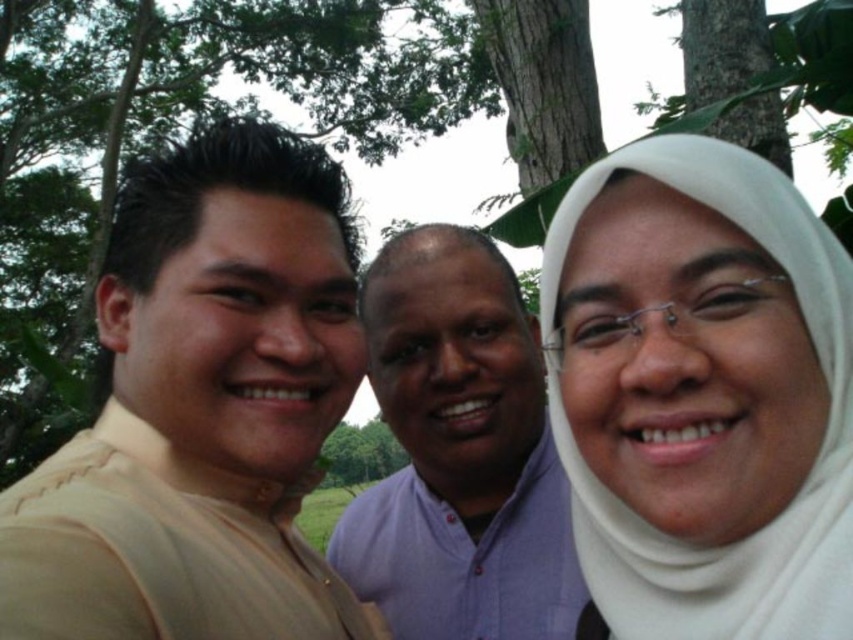
You are standing in front of the group and want to place a small gift exactly halfway between the two points mentioned. Which point is closer to you, point (256, 561) or point (4, 3)?

Point (256, 561) is closer to the viewer than point (4, 3), so the halfway point between them would be closer to you.

You are standing 1.5 meters away from the beige fabric shirt at left. Can you reach it without moving your feet?

The beige fabric shirt at left and viewer are 1.32 meters apart from each other. Since you are standing 1.5 meters away, you cannot reach it without moving your feet because the distance is greater than the typical arm reach.